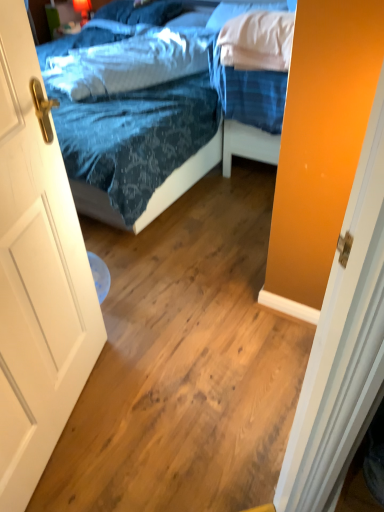
Measure the distance between point (x=215, y=12) and camera.

7.40 feet.

This screenshot has width=384, height=512. Identify the location of blue textured pillow at upper center, the 3th pillow from the back. (129, 62).

Locate an element on the screen. This screenshot has width=384, height=512. white wooden door at left is located at coordinates (37, 273).

This screenshot has height=512, width=384. In order to click on blue fabric pillow at upper center, arranged as the third pillow when viewed from the front in this screenshot , I will do `click(140, 12)`.

Measure the distance between point (96, 14) and camera.

3.08 meters.

Where is `blue fabric bed at upper right`? blue fabric bed at upper right is located at coordinates (252, 83).

Does blue fabric pillow at upper center, arranged as the third pillow when viewed from the front, have a lesser height compared to blue textured pillow at upper center, the 3th pillow from the back?

Yes.

Looking at this image, is blue fabric pillow at upper center, arranged as the third pillow when viewed from the front, further to the viewer compared to blue textured pillow at upper center, which is counted as the 1th pillow, starting from the front?

Yes, blue fabric pillow at upper center, arranged as the third pillow when viewed from the front, is behind blue textured pillow at upper center, which is counted as the 1th pillow, starting from the front.

How much distance is there between blue fabric pillow at upper center, which is the 1th pillow in back-to-front order, and blue textured pillow at upper center, the 3th pillow from the back?

blue fabric pillow at upper center, which is the 1th pillow in back-to-front order, is 52.60 centimeters away from blue textured pillow at upper center, the 3th pillow from the back.

Can you tell me how much blue fabric pillow at upper center, which is the 1th pillow in back-to-front order, and blue textured pillow at upper center, which is counted as the 1th pillow, starting from the front, differ in facing direction?

29.6 degrees.

Is white wooden door at left positioned far away from white soft pillow at upper right, which appears as the second pillow when viewed from the back?

That's right, there is a large distance between white wooden door at left and white soft pillow at upper right, which appears as the second pillow when viewed from the back.

Which of these two, white wooden door at left or white soft pillow at upper right, which is the 2th pillow in front-to-back order, stands taller?

Standing taller between the two is white wooden door at left.

Which point is more forward, [18,416] or [247,10]?

The point [18,416] is closer to the camera.

Does blue fabric bed at upper right have a larger size compared to white wooden door at left?

Yes, blue fabric bed at upper right is bigger than white wooden door at left.

Could you tell me if blue fabric bed at upper right is facing white wooden door at left?

Yes.

Considering the relative positions of blue fabric bed at upper right and white wooden door at left in the image provided, is blue fabric bed at upper right behind white wooden door at left?

Yes, blue fabric bed at upper right is further from the camera.

Measure the distance between blue fabric bed at upper right and white wooden door at left.

1.41 meters.

From their relative heights in the image, would you say white wooden door at left is taller or shorter than blue fabric bed at upper right?

In the image, white wooden door at left appears to be taller than blue fabric bed at upper right.

Measure the distance from white wooden door at left to blue fabric bed at upper right.

white wooden door at left and blue fabric bed at upper right are 4.63 feet apart.

Is white wooden door at left further to camera compared to blue fabric bed at upper right?

No, the depth of white wooden door at left is less than that of blue fabric bed at upper right.

Is white wooden door at left turned away from blue fabric bed at upper right?

No, white wooden door at left is not facing away from blue fabric bed at upper right.

Is blue fabric bed at upper right aimed at blue textured pillow at upper center, which is counted as the 1th pillow, starting from the front?

No, blue fabric bed at upper right does not turn towards blue textured pillow at upper center, which is counted as the 1th pillow, starting from the front.

Do you think blue fabric bed at upper right is within blue textured pillow at upper center, which is counted as the 1th pillow, starting from the front, or outside of it?

blue fabric bed at upper right is outside blue textured pillow at upper center, which is counted as the 1th pillow, starting from the front.

Are blue fabric bed at upper right and blue textured pillow at upper center, which is counted as the 1th pillow, starting from the front, located far from each other?

No, blue fabric bed at upper right is not far away from blue textured pillow at upper center, which is counted as the 1th pillow, starting from the front.

Which object is closer to the camera, white soft pillow at upper right, which is the 2th pillow in front-to-back order, or white wooden door at left?

Positioned in front is white wooden door at left.

Is white soft pillow at upper right, which appears as the second pillow when viewed from the back, smaller than white wooden door at left?

Actually, white soft pillow at upper right, which appears as the second pillow when viewed from the back, might be larger than white wooden door at left.

This screenshot has height=512, width=384. What are the coordinates of `door that is on the left side of white soft pillow at upper right, which is the 2th pillow in front-to-back order` in the screenshot? It's located at tap(37, 273).

Looking at this image, is blue textured pillow at upper center, which is counted as the 1th pillow, starting from the front, completely or partially outside of white soft pillow at upper right, which is the 2th pillow in front-to-back order?

Yes, blue textured pillow at upper center, which is counted as the 1th pillow, starting from the front, is not within white soft pillow at upper right, which is the 2th pillow in front-to-back order.

Between blue textured pillow at upper center, which is counted as the 1th pillow, starting from the front, and white soft pillow at upper right, which appears as the second pillow when viewed from the back, which one has more height?

white soft pillow at upper right, which appears as the second pillow when viewed from the back.

Is blue textured pillow at upper center, the 3th pillow from the back, touching white soft pillow at upper right, which is the 2th pillow in front-to-back order?

No, blue textured pillow at upper center, the 3th pillow from the back, is not next to white soft pillow at upper right, which is the 2th pillow in front-to-back order.

Is point (96, 96) in front of point (216, 12)?

No.

At what (x,y) coordinates should I click in order to perform the action: click on pillow that is the 1st object above the blue fabric pillow at upper center, which is the 1th pillow in back-to-front order (from a real-world perspective). Please return your answer as a coordinate pair (x, y). The width and height of the screenshot is (384, 512). Looking at the image, I should click on (129, 62).

The image size is (384, 512). I want to click on pillow that is the 2nd one when counting backward from the white wooden door at left, so click(238, 12).

Looking at the image, which one is located further to blue fabric pillow at upper center, arranged as the third pillow when viewed from the front, blue fabric bed at upper right or white soft pillow at upper right, which appears as the second pillow when viewed from the back?

blue fabric bed at upper right.

Which object lies nearer to the anchor point blue fabric bed at upper right, white soft pillow at upper right, which is the 2th pillow in front-to-back order, or blue textured pillow at upper center, which is counted as the 1th pillow, starting from the front?

white soft pillow at upper right, which is the 2th pillow in front-to-back order, is closer to blue fabric bed at upper right.

From the image, which object appears to be nearer to blue fabric pillow at upper center, arranged as the third pillow when viewed from the front, blue textured pillow at upper center, which is counted as the 1th pillow, starting from the front, or blue fabric bed at upper right?

blue textured pillow at upper center, which is counted as the 1th pillow, starting from the front, lies closer to blue fabric pillow at upper center, arranged as the third pillow when viewed from the front, than the other object.

Consider the image. Estimate the real-world distances between objects in this image. Which object is further from white soft pillow at upper right, which appears as the second pillow when viewed from the back, blue fabric pillow at upper center, which is the 1th pillow in back-to-front order, or blue textured pillow at upper center, the 3th pillow from the back?

Among the two, blue fabric pillow at upper center, which is the 1th pillow in back-to-front order, is located further to white soft pillow at upper right, which appears as the second pillow when viewed from the back.

Which object lies nearer to the anchor point white soft pillow at upper right, which appears as the second pillow when viewed from the back, blue textured pillow at upper center, which is counted as the 1th pillow, starting from the front, or blue fabric pillow at upper center, arranged as the third pillow when viewed from the front?

blue textured pillow at upper center, which is counted as the 1th pillow, starting from the front, is closer to white soft pillow at upper right, which appears as the second pillow when viewed from the back.

Which object lies nearer to the anchor point white soft pillow at upper right, which is the 2th pillow in front-to-back order, blue fabric bed at upper right or blue textured pillow at upper center, the 3th pillow from the back?

Among the two, blue fabric bed at upper right is located nearer to white soft pillow at upper right, which is the 2th pillow in front-to-back order.

When comparing their distances from white wooden door at left, does blue fabric bed at upper right or blue textured pillow at upper center, the 3th pillow from the back, seem closer?

The object closer to white wooden door at left is blue fabric bed at upper right.

Looking at the image, which one is located further to white wooden door at left, blue fabric pillow at upper center, which is the 1th pillow in back-to-front order, or blue fabric bed at upper right?

Based on the image, blue fabric pillow at upper center, which is the 1th pillow in back-to-front order, appears to be further to white wooden door at left.

Identify the location of pillow between blue fabric bed at upper right and white soft pillow at upper right, which is the 2th pillow in front-to-back order, in the front-back direction. (129, 62).

I want to click on bed between white wooden door at left and blue textured pillow at upper center, the 3th pillow from the back, in the front-back direction, so click(x=252, y=83).

Where is `pillow located between white wooden door at left and white soft pillow at upper right, which appears as the second pillow when viewed from the back, in the depth direction`? The height and width of the screenshot is (512, 384). pillow located between white wooden door at left and white soft pillow at upper right, which appears as the second pillow when viewed from the back, in the depth direction is located at coordinates (129, 62).

Identify the location of bed between white wooden door at left and white soft pillow at upper right, which is the 2th pillow in front-to-back order, in the front-back direction. (252, 83).